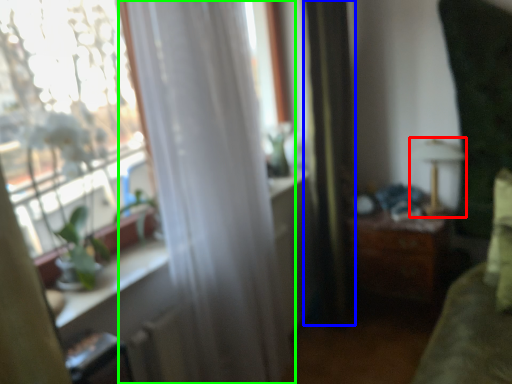
Question: Which is farther away from lamp (highlighted by a red box)? curtain (highlighted by a blue box) or curtain (highlighted by a green box)?

Choices:
 (A) curtain
 (B) curtain

Answer: (B)